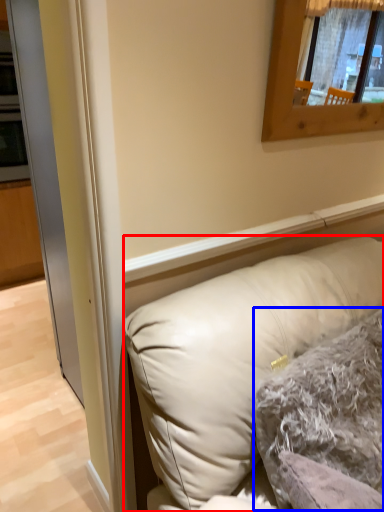
Question: Which of the following is the farthest to the observer, pillow (highlighted by a red box) or pillow (highlighted by a blue box)?

Choices:
 (A) pillow
 (B) pillow

Answer: (B)